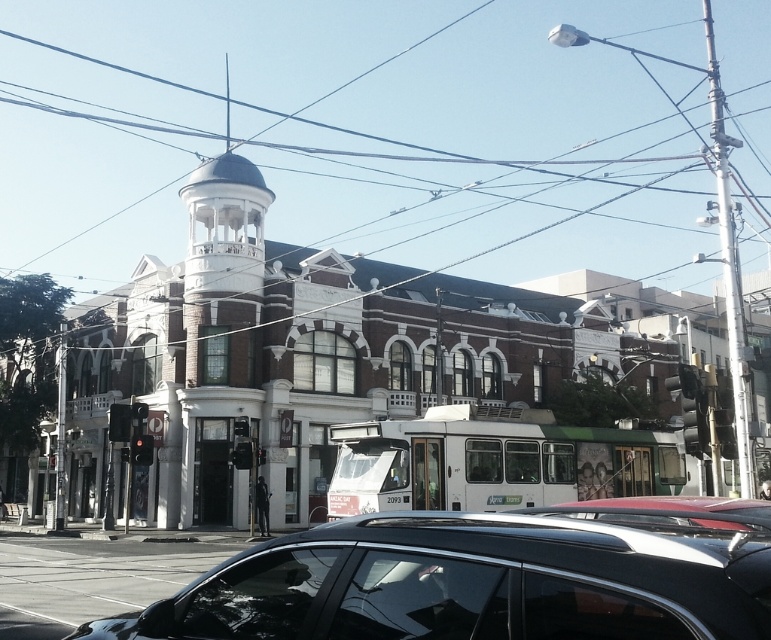
You are a pedestrian standing at the tram stop in front of the historic building. You need to cross the street to reach the park on the other side. Which vehicle, the white matte bus at center or the metallic silver car at lower center, is closer to you as you prepare to cross?

The white matte bus at center is closer to you than the metallic silver car at lower center, so you should be cautious of the bus first as you cross the street.

You are a pedestrian standing at the tram stop. You see the black glossy car at lower center and the metallic silver car at lower center. Which car is closer to you?

The black glossy car at lower center is closer to you because it is positioned over the metallic silver car at lower center, indicating it is in front.